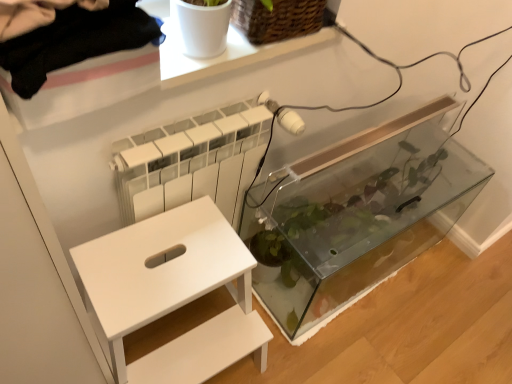
Question: From a real-world perspective, is white matte step stool at lower left on top of woven brown basket at upper center?

Choices:
 (A) yes
 (B) no

Answer: (B)

Question: Is the depth of white matte step stool at lower left greater than that of woven brown basket at upper center?

Choices:
 (A) yes
 (B) no

Answer: (B)

Question: Is white matte step stool at lower left facing away from woven brown basket at upper center?

Choices:
 (A) no
 (B) yes

Answer: (A)

Question: Does white matte step stool at lower left appear on the left side of woven brown basket at upper center?

Choices:
 (A) yes
 (B) no

Answer: (A)

Question: Is white matte step stool at lower left bigger than woven brown basket at upper center?

Choices:
 (A) yes
 (B) no

Answer: (A)

Question: Is woven brown basket at upper center a part of white matte step stool at lower left?

Choices:
 (A) no
 (B) yes

Answer: (A)

Question: Could you tell me if white matte step stool at lower left is facing transparent glass tank at center?

Choices:
 (A) yes
 (B) no

Answer: (B)

Question: Is white matte step stool at lower left turned away from transparent glass tank at center?

Choices:
 (A) yes
 (B) no

Answer: (B)

Question: Does white matte step stool at lower left have a smaller size compared to transparent glass tank at center?

Choices:
 (A) no
 (B) yes

Answer: (B)

Question: Considering the relative sizes of white matte step stool at lower left and transparent glass tank at center in the image provided, is white matte step stool at lower left thinner than transparent glass tank at center?

Choices:
 (A) no
 (B) yes

Answer: (A)

Question: Does white matte step stool at lower left appear on the left side of transparent glass tank at center?

Choices:
 (A) no
 (B) yes

Answer: (B)

Question: Is white matte step stool at lower left positioned far away from transparent glass tank at center?

Choices:
 (A) no
 (B) yes

Answer: (A)

Question: Can you confirm if woven brown basket at upper center is wider than white matte step stool at lower left?

Choices:
 (A) yes
 (B) no

Answer: (B)